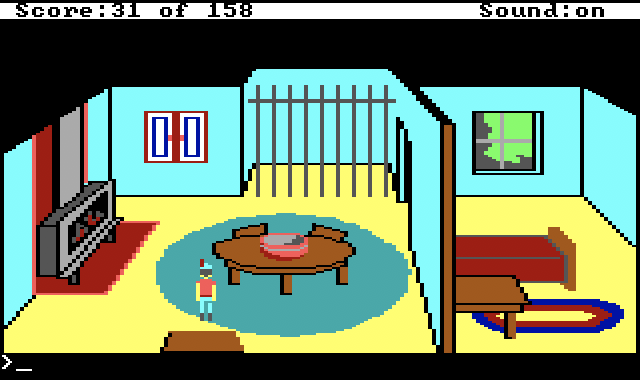
The width and height of the screenshot is (640, 380). In order to click on footboard in this screenshot , I will do `click(569, 243)`.